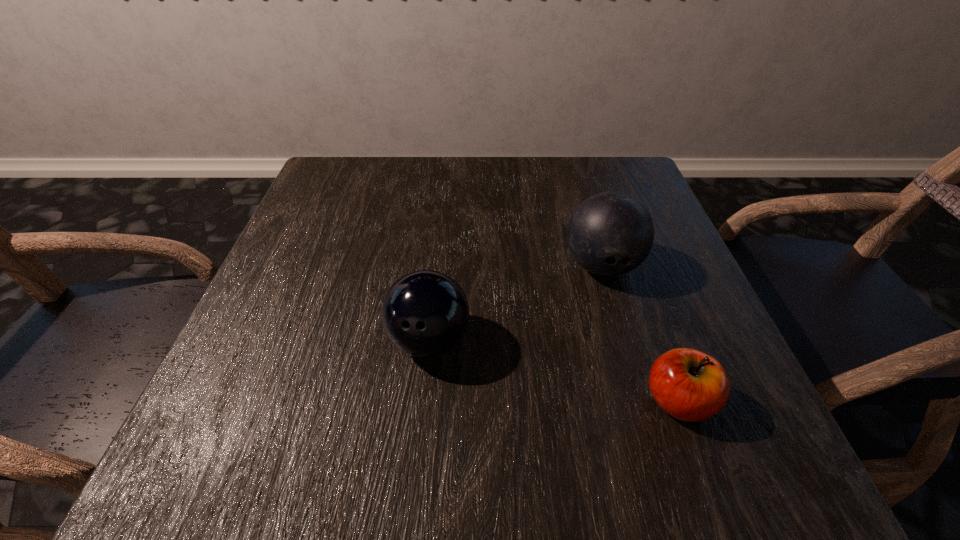
Find the location of a particular element. the farthest object is located at coordinates (610, 233).

Where is `the right bowling ball`? the right bowling ball is located at coordinates (610, 233).

Image resolution: width=960 pixels, height=540 pixels. I want to click on the leftmost object, so click(x=425, y=313).

Identify the location of the nearer bowling ball. This screenshot has width=960, height=540. (425, 313).

Find the location of a particular element. the shortest object is located at coordinates (689, 385).

The width and height of the screenshot is (960, 540). Identify the location of free space located on the grip area of the right bowling ball. (640, 397).

Where is `free region located on the side of the left bowling ball with the finger holes`? This screenshot has height=540, width=960. free region located on the side of the left bowling ball with the finger holes is located at coordinates (415, 483).

I want to click on free space located on the back of the shortest object, so click(x=617, y=232).

This screenshot has height=540, width=960. I want to click on object located in the near edge section of the desktop, so click(689, 385).

Where is `bowling ball present at the right edge`? bowling ball present at the right edge is located at coordinates (610, 233).